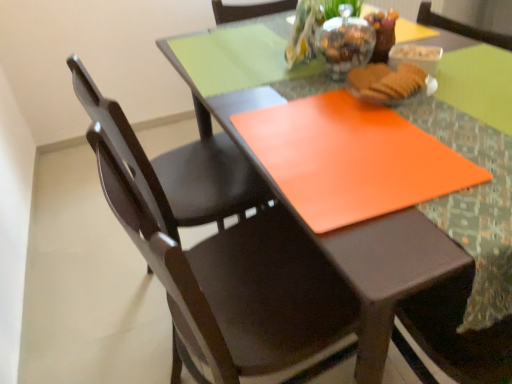
Question: Is point (308, 319) positioned closer to the camera than point (283, 130)?

Choices:
 (A) farther
 (B) closer

Answer: (A)

Question: Based on their positions, is matte dark wood chair at center, the 1th chair in the front-to-back sequence, located to the left or right of orange matte placemat at center?

Choices:
 (A) right
 (B) left

Answer: (B)

Question: Based on their relative distances, which object is farther from the matte brown biscuit at center?

Choices:
 (A) transparent glass jar at upper center
 (B) translucent glass vase at upper center
 (C) matte dark wood chair at left, which is the first chair in back-to-front order
 (D) matte dark wood chair at center, the 1th chair in the front-to-back sequence
 (E) orange matte placemat at center

Answer: (C)

Question: Which is nearer to the matte brown biscuit at center?

Choices:
 (A) translucent glass vase at upper center
 (B) matte dark wood chair at left, placed as the 2th chair when sorted from front to back
 (C) matte dark wood chair at center, the 1th chair in the front-to-back sequence
 (D) orange matte placemat at center
 (E) transparent glass jar at upper center

Answer: (E)